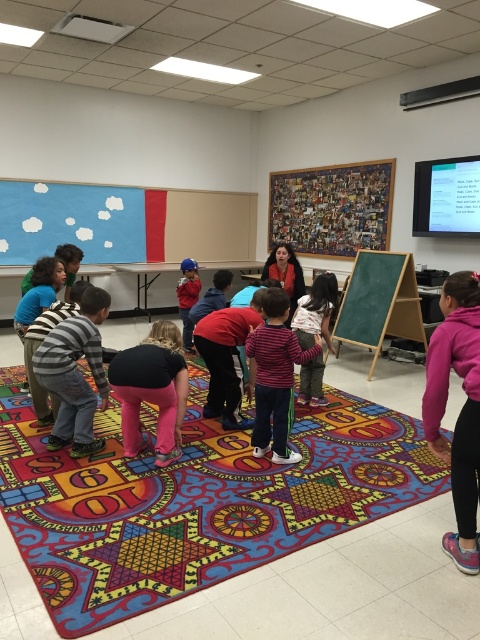
Is point (117, 433) behind point (179, 289)?

No.

Can you confirm if multicolored carpet at center is positioned above matte red shirt at center?

No, multicolored carpet at center is not above matte red shirt at center.

Looking at this image, who is more distant from viewer, (151, 481) or (197, 294)?

The point (197, 294) is behind.

What are the coordinates of `multicolored carpet at center` in the screenshot? It's located at [194, 500].

Can you confirm if black fabric shirt at center is wider than matte red sweater at center?

Yes.

Which is more to the right, black fabric shirt at center or matte red sweater at center?

matte red sweater at center is more to the right.

Between point (175, 452) and point (268, 264), which one is positioned behind?

Point (268, 264)

Find the location of `black fabric shirt at center`. black fabric shirt at center is located at coordinates (153, 388).

Image resolution: width=480 pixels, height=640 pixels. What do you see at coordinates (380, 301) in the screenshot? I see `green chalkboard at center` at bounding box center [380, 301].

Who is more forward, (x=377, y=260) or (x=284, y=362)?

Point (x=284, y=362) is more forward.

Where is `green chalkboard at center`? This screenshot has width=480, height=640. green chalkboard at center is located at coordinates (380, 301).